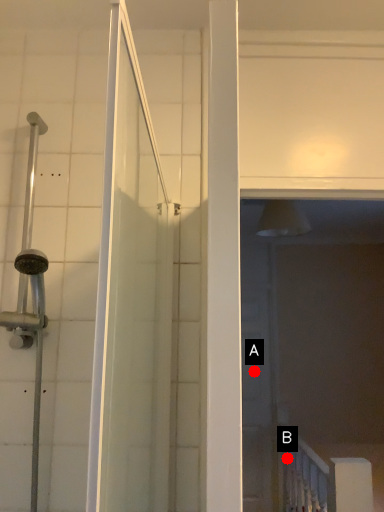
Question: Two points are circled on the image, labeled by A and B beside each circle. Which point is farther to the camera?

Choices:
 (A) A is further
 (B) B is further

Answer: (A)